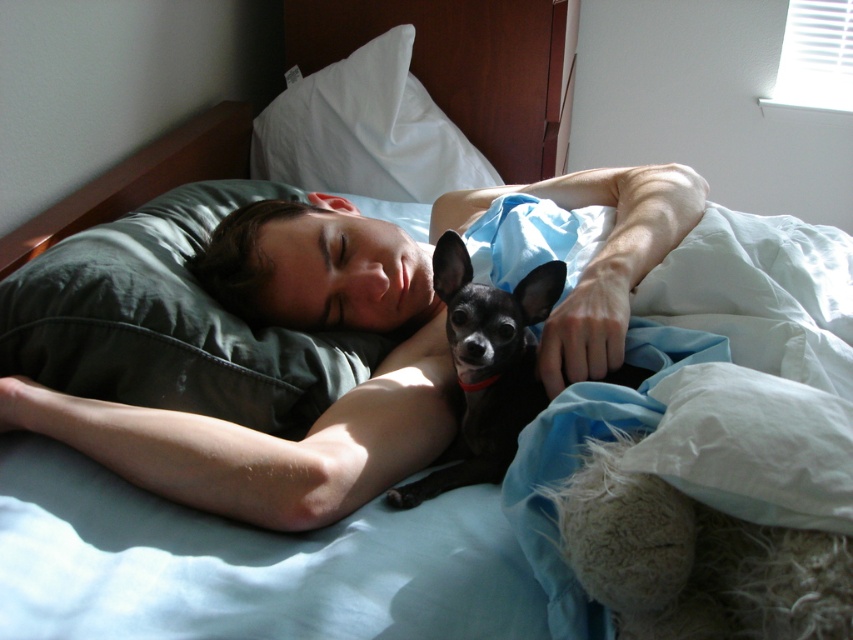
Question: Which point appears closest to the camera in this image?

Choices:
 (A) 474,371
 (B) 368,125
 (C) 172,417
 (D) 90,280

Answer: (C)

Question: Is white fabric pillow at upper center positioned at the back of black smooth dog at center?

Choices:
 (A) no
 (B) yes

Answer: (B)

Question: Is the position of matte green pillow at upper left more distant than that of green fabric pillow at upper center?

Choices:
 (A) yes
 (B) no

Answer: (B)

Question: Among these points, which one is farthest from the camera?

Choices:
 (A) [49, 269]
 (B) [544, 289]

Answer: (A)

Question: Is green fabric pillow at upper center wider than black smooth dog at center?

Choices:
 (A) yes
 (B) no

Answer: (A)

Question: Considering the real-world distances, which object is closest to the green fabric pillow at upper center?

Choices:
 (A) white fabric pillow at upper center
 (B) matte green pillow at upper left
 (C) black smooth dog at center

Answer: (B)